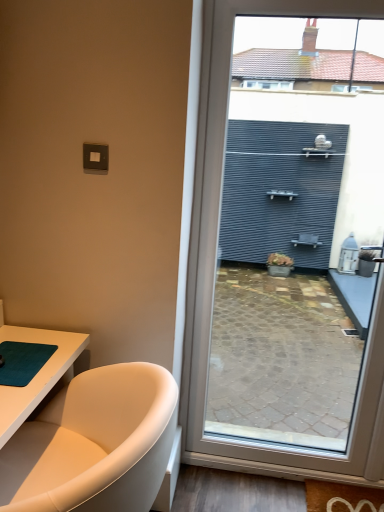
Question: From a real-world perspective, is white leather bathtub at lower left physically above matte gray wall at right?

Choices:
 (A) no
 (B) yes

Answer: (A)

Question: From the image's perspective, is white leather bathtub at lower left located above matte gray wall at right?

Choices:
 (A) no
 (B) yes

Answer: (A)

Question: Considering the relative sizes of white leather bathtub at lower left and matte gray wall at right in the image provided, is white leather bathtub at lower left shorter than matte gray wall at right?

Choices:
 (A) yes
 (B) no

Answer: (A)

Question: Is white leather bathtub at lower left in front of matte gray wall at right?

Choices:
 (A) no
 (B) yes

Answer: (B)

Question: Considering the relative positions of white leather bathtub at lower left and matte gray wall at right in the image provided, is white leather bathtub at lower left to the right of matte gray wall at right from the viewer's perspective?

Choices:
 (A) yes
 (B) no

Answer: (B)

Question: Would you say matte gray wall at right is inside or outside white leather bathtub at lower left?

Choices:
 (A) inside
 (B) outside

Answer: (B)

Question: Considering the relative positions of matte gray wall at right and white leather bathtub at lower left in the image provided, is matte gray wall at right to the left or to the right of white leather bathtub at lower left?

Choices:
 (A) left
 (B) right

Answer: (B)

Question: From a real-world perspective, is matte gray wall at right positioned above or below white leather bathtub at lower left?

Choices:
 (A) above
 (B) below

Answer: (A)

Question: Considering the positions of matte gray wall at right and white leather bathtub at lower left in the image, is matte gray wall at right taller or shorter than white leather bathtub at lower left?

Choices:
 (A) short
 (B) tall

Answer: (B)

Question: Would you say teal matte yoga mat at lower left is inside or outside white leather bathtub at lower left?

Choices:
 (A) outside
 (B) inside

Answer: (B)

Question: In terms of height, does teal matte yoga mat at lower left look taller or shorter compared to white leather bathtub at lower left?

Choices:
 (A) short
 (B) tall

Answer: (A)

Question: From the image's perspective, is teal matte yoga mat at lower left positioned above or below white leather bathtub at lower left?

Choices:
 (A) above
 (B) below

Answer: (A)

Question: Considering their positions, is teal matte yoga mat at lower left located in front of or behind white leather bathtub at lower left?

Choices:
 (A) behind
 (B) front

Answer: (A)

Question: From a real-world perspective, relative to matte gray wall at right, is white leather bathtub at lower left vertically above or below?

Choices:
 (A) below
 (B) above

Answer: (A)

Question: Looking at the image, does white leather bathtub at lower left seem bigger or smaller compared to matte gray wall at right?

Choices:
 (A) small
 (B) big

Answer: (B)